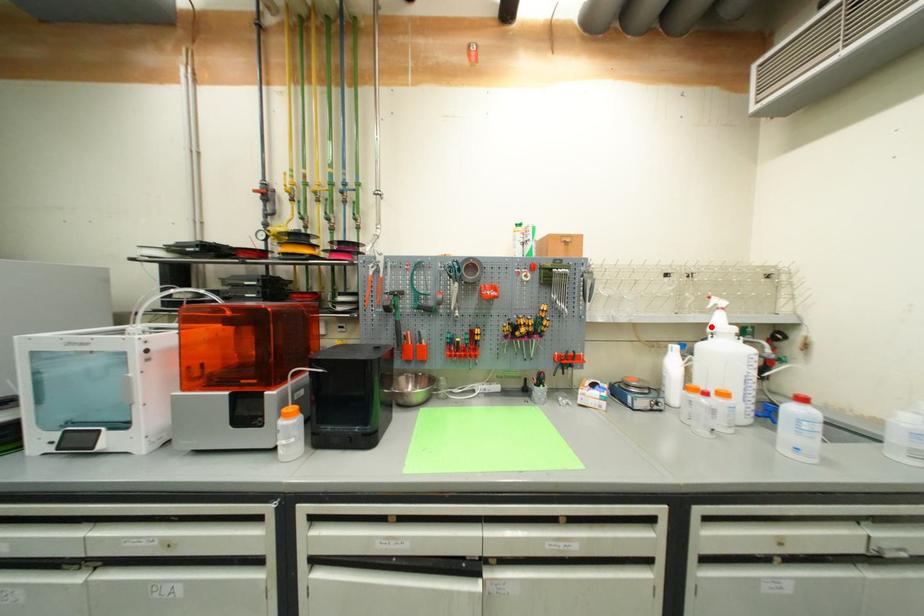
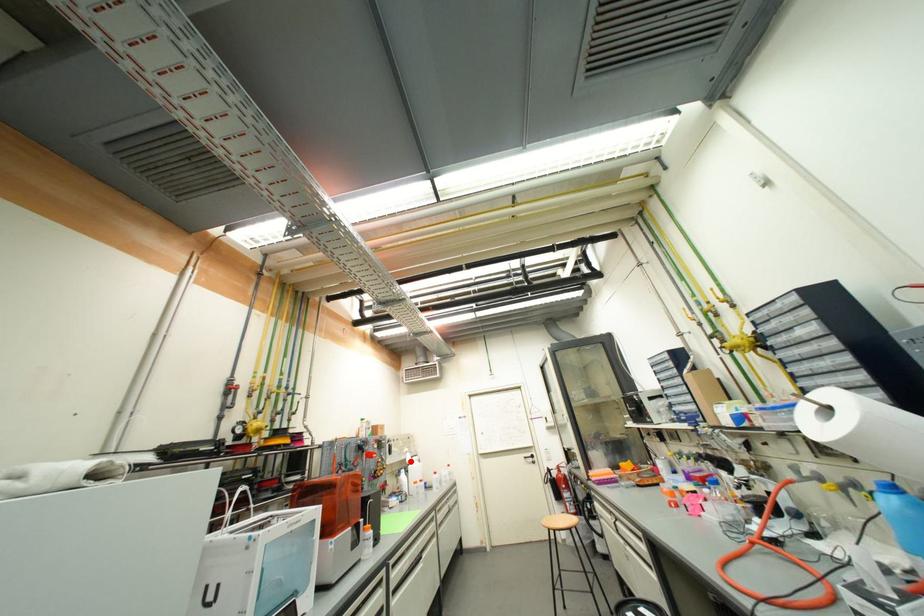
I am providing you with two images of the same scene from different viewpoints. A red point is marked on the first image and another point is marked on the second image. Is the red point in image1 aligned with the point shown in image2?

Yes